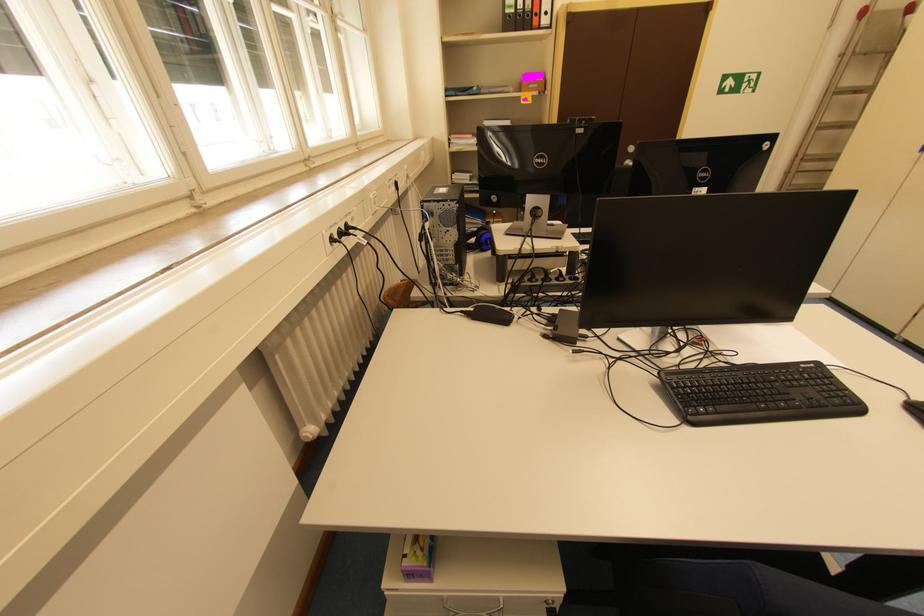
Find where to lift the small computer tower. Please return your answer as a coordinate pair (x, y).

(445, 232)